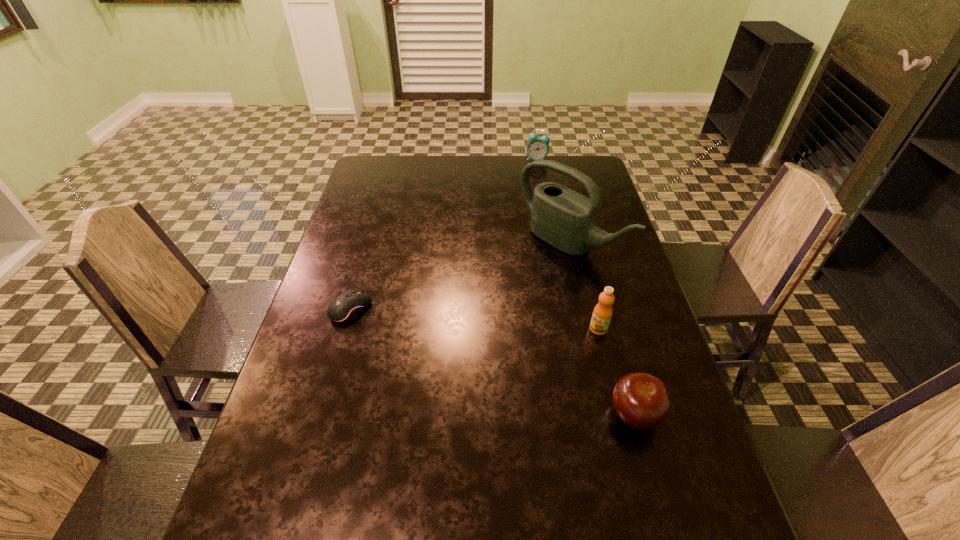
Point out which object is positioned as the third nearest to the apple. Please provide its 2D coordinates. Your answer should be formatted as a tuple, i.e. [(x, y)], where the tuple contains the x and y coordinates of a point satisfying the conditions above.

[(347, 306)]

Where is `free location that satisfies the following two spatial constraints: 1. on the front side of the alarm clock; 2. on the left side of the second tallest object`? free location that satisfies the following two spatial constraints: 1. on the front side of the alarm clock; 2. on the left side of the second tallest object is located at coordinates (567, 329).

Find the location of a particular element. Image resolution: width=960 pixels, height=540 pixels. vacant space that satisfies the following two spatial constraints: 1. on the front side of the tallest object; 2. on the left side of the nearest object is located at coordinates (608, 415).

The width and height of the screenshot is (960, 540). I want to click on free spot that satisfies the following two spatial constraints: 1. on the front side of the alarm clock; 2. on the left side of the nearest object, so click(x=584, y=415).

The height and width of the screenshot is (540, 960). I want to click on free spot that satisfies the following two spatial constraints: 1. on the front side of the alarm clock; 2. on the left side of the fourth nearest object, so click(552, 245).